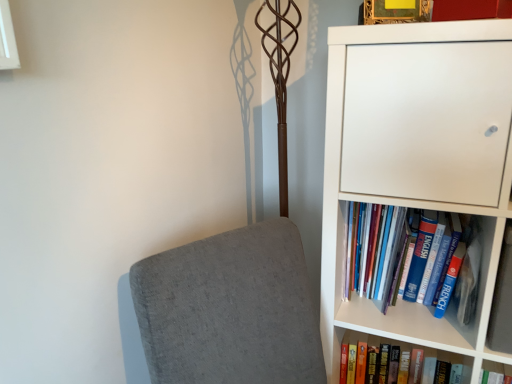
Question: Can you see hardcover book at lower right, the second book viewed from the top, touching white glossy window at upper left?

Choices:
 (A) yes
 (B) no

Answer: (B)

Question: From a real-world perspective, is hardcover book at lower right, which is the 1th book in bottom-to-top order, below white glossy window at upper left?

Choices:
 (A) no
 (B) yes

Answer: (B)

Question: Does hardcover book at lower right, the second book viewed from the top, have a lesser height compared to white glossy window at upper left?

Choices:
 (A) no
 (B) yes

Answer: (B)

Question: Is hardcover book at lower right, which is the 1th book in bottom-to-top order, facing towards white glossy window at upper left?

Choices:
 (A) no
 (B) yes

Answer: (A)

Question: Is hardcover book at lower right, the second book viewed from the top, behind white glossy window at upper left?

Choices:
 (A) yes
 (B) no

Answer: (A)

Question: Considering the relative sizes of hardcover book at lower right, the second book viewed from the top, and white glossy window at upper left in the image provided, is hardcover book at lower right, the second book viewed from the top, thinner than white glossy window at upper left?

Choices:
 (A) no
 (B) yes

Answer: (A)

Question: Can you confirm if white matte bookcase at right is thinner than white glossy window at upper left?

Choices:
 (A) no
 (B) yes

Answer: (A)

Question: From a real-world perspective, is white matte bookcase at right located higher than white glossy window at upper left?

Choices:
 (A) no
 (B) yes

Answer: (A)

Question: Is white matte bookcase at right next to white glossy window at upper left?

Choices:
 (A) no
 (B) yes

Answer: (A)

Question: Would you say white glossy window at upper left is part of white matte bookcase at right's contents?

Choices:
 (A) no
 (B) yes

Answer: (A)

Question: Does white matte bookcase at right have a greater height compared to white glossy window at upper left?

Choices:
 (A) no
 (B) yes

Answer: (B)

Question: From the image's perspective, is white matte bookcase at right located beneath white glossy window at upper left?

Choices:
 (A) no
 (B) yes

Answer: (B)

Question: Can you confirm if blue hardcover book at right, positioned as the first book in top-to-bottom order, is wider than hardcover book at lower right, which is the 1th book in bottom-to-top order?

Choices:
 (A) yes
 (B) no

Answer: (A)